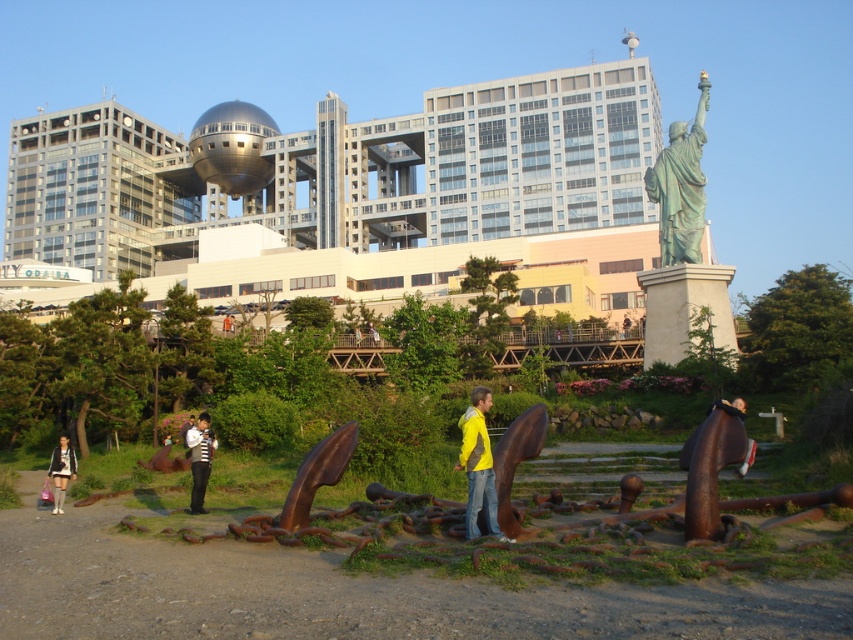
You are standing in the park and want to take a photo of the yellow matte jacket at center without the green patina statue at upper right blocking the view. Is there a way to position yourself so that the statue is out of the frame?

The yellow matte jacket at center is behind the green patina statue at upper right, so you can move to a position where the statue is not between you and the jacket. By moving around to the side or behind the statue, you can capture the jacket without the statue blocking the view.

You are a photographer trying to capture both the green patina statue at upper right and the yellow matte jacket at center in the same frame. Based on their sizes, which one should you focus on to ensure both are visible without cropping?

The green patina statue at upper right is bigger than the yellow matte jacket at center, so you should focus on the green patina statue at upper right to ensure both are visible without cropping.

You are standing at the center of the park and see the rusty metal anchor at lower right. What is the nearest object to the point marked at coordinates point (712,465)?

The nearest object to the point marked at coordinates point (712,465) is the rusty metal anchor at lower right.